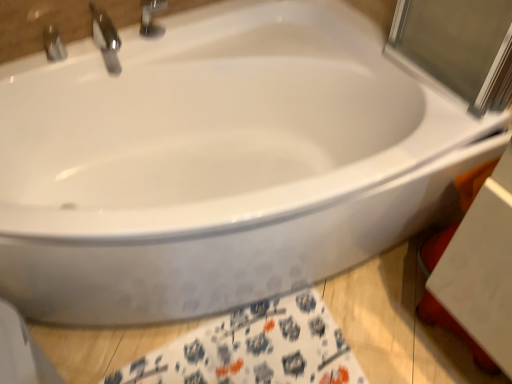
What is the approximate height of polished chrome faucet at upper left, placed as the second tap when sorted from left to right?

4.00 inches.

At what (x,y) coordinates should I click in order to perform the action: click on metallic silver faucet at upper left, the first tap positioned from the left. Please return your answer as a coordinate pair (x, y). Looking at the image, I should click on (53, 44).

Locate an element on the screen. The image size is (512, 384). white fabric towel at lower center is located at coordinates (254, 349).

Could metallic silver faucet at upper left, the first tap positioned from the left, be considered to be inside white fabric towel at lower center?

No.

Between point (319, 308) and point (59, 46), which one is positioned behind?

Point (319, 308)

From a real-world perspective, which is physically above, white fabric towel at lower center or metallic silver faucet at upper left, which is the second tap from right to left?

metallic silver faucet at upper left, which is the second tap from right to left.

Considering the relative positions of polished chrome faucet at upper left, the 1th tap positioned from the right, and metallic silver faucet at upper left, which is the second tap from right to left, in the image provided, is polished chrome faucet at upper left, the 1th tap positioned from the right, to the right of metallic silver faucet at upper left, which is the second tap from right to left, from the viewer's perspective?

Correct, you'll find polished chrome faucet at upper left, the 1th tap positioned from the right, to the right of metallic silver faucet at upper left, which is the second tap from right to left.

Is polished chrome faucet at upper left, the 1th tap positioned from the right, far from metallic silver faucet at upper left, the first tap positioned from the left?

No, there isn't a large distance between polished chrome faucet at upper left, the 1th tap positioned from the right, and metallic silver faucet at upper left, the first tap positioned from the left.

Is polished chrome faucet at upper left, the 1th tap positioned from the right, positioned with its back to metallic silver faucet at upper left, which is the second tap from right to left?

No, metallic silver faucet at upper left, which is the second tap from right to left, is not at the back of polished chrome faucet at upper left, the 1th tap positioned from the right.

Is polished chrome faucet at upper left, placed as the second tap when sorted from left to right, in front of or behind metallic silver faucet at upper left, the first tap positioned from the left, in the image?

In the image, polished chrome faucet at upper left, placed as the second tap when sorted from left to right, appears in front of metallic silver faucet at upper left, the first tap positioned from the left.

Which is more distant, (x=232, y=327) or (x=110, y=31)?

Positioned behind is point (x=110, y=31).

Can you confirm if white fabric towel at lower center is shorter than polished chrome faucet at upper left, the 1th tap positioned from the right?

Correct, white fabric towel at lower center is not as tall as polished chrome faucet at upper left, the 1th tap positioned from the right.

Is the position of white fabric towel at lower center less distant than that of polished chrome faucet at upper left, placed as the second tap when sorted from left to right?

Yes.

Is white fabric towel at lower center spatially inside polished chrome faucet at upper left, placed as the second tap when sorted from left to right, or outside of it?

white fabric towel at lower center lies outside polished chrome faucet at upper left, placed as the second tap when sorted from left to right.

Between metallic silver faucet at upper left, which is the second tap from right to left, and polished chrome faucet at upper left, the 1th tap positioned from the right, which one has more height?

polished chrome faucet at upper left, the 1th tap positioned from the right, is taller.

How many degrees apart are the facing directions of metallic silver faucet at upper left, which is the second tap from right to left, and polished chrome faucet at upper left, placed as the second tap when sorted from left to right?

The facing directions of metallic silver faucet at upper left, which is the second tap from right to left, and polished chrome faucet at upper left, placed as the second tap when sorted from left to right, are 2.79 degrees apart.

Does point (44, 36) come farther from viewer compared to point (106, 55)?

No, it is in front of (106, 55).

Is the surface of metallic silver faucet at upper left, which is the second tap from right to left, in direct contact with polished chrome faucet at upper left, placed as the second tap when sorted from left to right?

No.

Between polished chrome faucet at upper left, placed as the second tap when sorted from left to right, and white fabric towel at lower center, which one is positioned behind?

polished chrome faucet at upper left, placed as the second tap when sorted from left to right, is further from the camera.

Is polished chrome faucet at upper left, placed as the second tap when sorted from left to right, oriented towards white fabric towel at lower center?

No, polished chrome faucet at upper left, placed as the second tap when sorted from left to right, is not oriented towards white fabric towel at lower center.

Can you confirm if polished chrome faucet at upper left, placed as the second tap when sorted from left to right, is shorter than white fabric towel at lower center?

Incorrect, the height of polished chrome faucet at upper left, placed as the second tap when sorted from left to right, does not fall short of that of white fabric towel at lower center.

Measure the distance from metallic silver faucet at upper left, the first tap positioned from the left, to white fabric towel at lower center.

metallic silver faucet at upper left, the first tap positioned from the left, is 3.72 feet away from white fabric towel at lower center.

How many degrees apart are the facing directions of metallic silver faucet at upper left, which is the second tap from right to left, and white fabric towel at lower center?

The facing directions of metallic silver faucet at upper left, which is the second tap from right to left, and white fabric towel at lower center are 3.42 degrees apart.

From the image's perspective, which is below, metallic silver faucet at upper left, the first tap positioned from the left, or white fabric towel at lower center?

white fabric towel at lower center.

Is metallic silver faucet at upper left, the first tap positioned from the left, wider than white fabric towel at lower center?

No.

From the white fabric towel at lower center, count 2nd taps backward and point to it. Please provide its 2D coordinates.

[(53, 44)]

You are a GUI agent. You are given a task and a screenshot of the screen. Output one action in this format:
    pyautogui.click(x=<x>, y=<y>)
    Task: Click on the tap below the polished chrome faucet at upper left, the 1th tap positioned from the right (from the image's perspective)
    The image size is (512, 384).
    Given the screenshot: What is the action you would take?
    pyautogui.click(x=53, y=44)

When comparing their distances from white fabric towel at lower center, does polished chrome faucet at upper left, the 1th tap positioned from the right, or metallic silver faucet at upper left, which is the second tap from right to left, seem further?

The object further to white fabric towel at lower center is metallic silver faucet at upper left, which is the second tap from right to left.

Considering their positions, is white fabric towel at lower center positioned closer to polished chrome faucet at upper left, placed as the second tap when sorted from left to right, than metallic silver faucet at upper left, the first tap positioned from the left?

metallic silver faucet at upper left, the first tap positioned from the left.

Based on their spatial positions, is metallic silver faucet at upper left, which is the second tap from right to left, or polished chrome faucet at upper left, the 1th tap positioned from the right, further from white fabric towel at lower center?

metallic silver faucet at upper left, which is the second tap from right to left, lies further to white fabric towel at lower center than the other object.

When comparing their distances from metallic silver faucet at upper left, the first tap positioned from the left, does polished chrome faucet at upper left, the 1th tap positioned from the right, or white fabric towel at lower center seem further?

The object further to metallic silver faucet at upper left, the first tap positioned from the left, is white fabric towel at lower center.

Based on their spatial positions, is metallic silver faucet at upper left, the first tap positioned from the left, or white fabric towel at lower center further from polished chrome faucet at upper left, placed as the second tap when sorted from left to right?

Among the two, white fabric towel at lower center is located further to polished chrome faucet at upper left, placed as the second tap when sorted from left to right.

From the image, which object appears to be farther from metallic silver faucet at upper left, the first tap positioned from the left, white fabric towel at lower center or polished chrome faucet at upper left, placed as the second tap when sorted from left to right?

The object further to metallic silver faucet at upper left, the first tap positioned from the left, is white fabric towel at lower center.

Find the location of `tap between polished chrome faucet at upper left, the 1th tap positioned from the right, and white fabric towel at lower center vertically`. tap between polished chrome faucet at upper left, the 1th tap positioned from the right, and white fabric towel at lower center vertically is located at coordinates (53, 44).